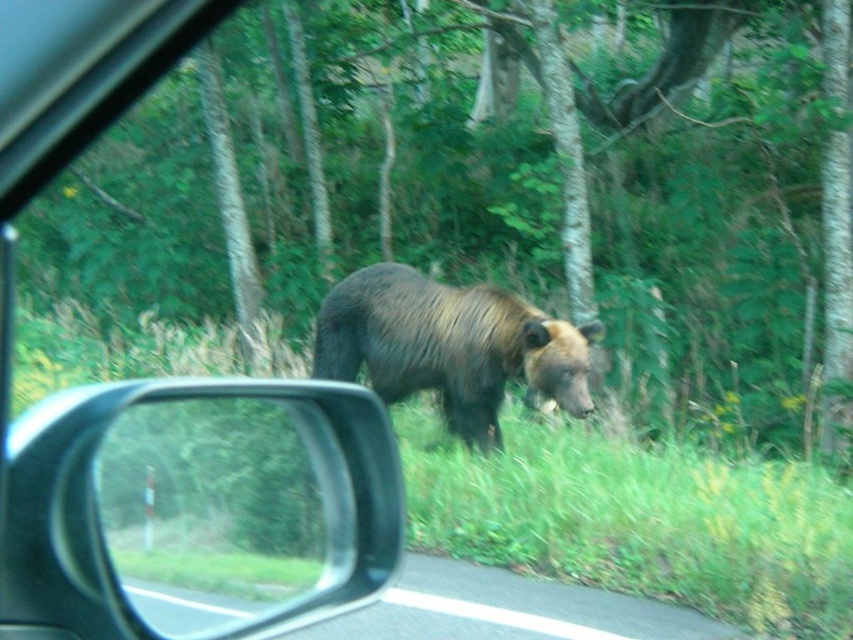
Between green leafy tree at center and clear plastic side mirror at lower left, which one has less height?

Standing shorter between the two is clear plastic side mirror at lower left.

Is green leafy tree at center behind clear plastic side mirror at lower left?

No, it is in front of clear plastic side mirror at lower left.

The width and height of the screenshot is (853, 640). What are the coordinates of `green leafy tree at center` in the screenshot? It's located at (448, 200).

Consider the image. Which is more to the left, green leafy tree at center or brown furry bear at center?

green leafy tree at center

Who is higher up, green leafy tree at center or brown furry bear at center?

green leafy tree at center is higher up.

Describe the element at coordinates (448, 200) in the screenshot. The width and height of the screenshot is (853, 640). I see `green leafy tree at center` at that location.

Locate an element on the screen. Image resolution: width=853 pixels, height=640 pixels. green leafy tree at center is located at coordinates (448, 200).

Who is lower down, clear plastic side mirror at lower left or brown furry bear at center?

Positioned lower is clear plastic side mirror at lower left.

Who is positioned more to the left, clear plastic side mirror at lower left or brown furry bear at center?

From the viewer's perspective, clear plastic side mirror at lower left appears more on the left side.

Find the location of a particular element. Image resolution: width=853 pixels, height=640 pixels. clear plastic side mirror at lower left is located at coordinates (248, 506).